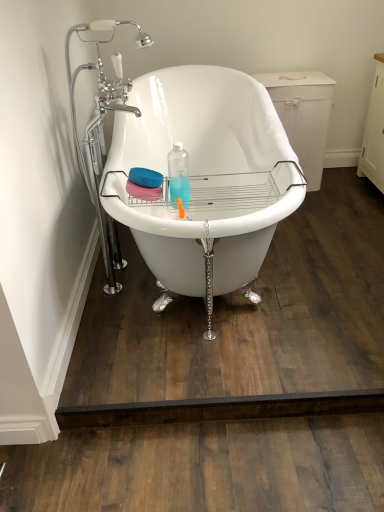
I want to click on white glossy bathtub at center, so click(x=204, y=177).

This screenshot has height=512, width=384. What do you see at coordinates (204, 177) in the screenshot? I see `white glossy bathtub at center` at bounding box center [204, 177].

Where is `chrome/metallic faucet at upper left`? The width and height of the screenshot is (384, 512). chrome/metallic faucet at upper left is located at coordinates (102, 131).

The height and width of the screenshot is (512, 384). Describe the element at coordinates (102, 131) in the screenshot. I see `chrome/metallic faucet at upper left` at that location.

Find the location of a particular element. This screenshot has height=512, width=384. white glossy bathtub at center is located at coordinates click(x=204, y=177).

In the scene shown: Can you confirm if white glossy bathtub at center is positioned to the right of chrome/metallic faucet at upper left?

Indeed, white glossy bathtub at center is positioned on the right side of chrome/metallic faucet at upper left.

Which object is further away from the camera, white glossy bathtub at center or chrome/metallic faucet at upper left?

chrome/metallic faucet at upper left is behind.

Which is in front, point (146, 129) or point (104, 103)?

The point (104, 103) is in front.

From the image's perspective, is white glossy bathtub at center under chrome/metallic faucet at upper left?

Yes, from the image's perspective, white glossy bathtub at center is beneath chrome/metallic faucet at upper left.

From a real-world perspective, is white glossy bathtub at center on chrome/metallic faucet at upper left?

Actually, white glossy bathtub at center is physically below chrome/metallic faucet at upper left in the real world.

From the picture: Which of these two, white glossy bathtub at center or chrome/metallic faucet at upper left, is wider?

With larger width is white glossy bathtub at center.

Considering the sizes of objects white glossy bathtub at center and chrome/metallic faucet at upper left in the image provided, who is shorter, white glossy bathtub at center or chrome/metallic faucet at upper left?

Standing shorter between the two is white glossy bathtub at center.

Is white glossy bathtub at center bigger or smaller than chrome/metallic faucet at upper left?

In the image, white glossy bathtub at center appears to be larger than chrome/metallic faucet at upper left.

Looking at this image, would you say white glossy bathtub at center is inside or outside chrome/metallic faucet at upper left?

white glossy bathtub at center is located beyond the bounds of chrome/metallic faucet at upper left.

Is white glossy bathtub at center not near chrome/metallic faucet at upper left?

That's not correct — white glossy bathtub at center is a little close to chrome/metallic faucet at upper left.

Is white glossy bathtub at center looking in the opposite direction of chrome/metallic faucet at upper left?

Yes, white glossy bathtub at center is facing away from chrome/metallic faucet at upper left.

How far apart are white glossy bathtub at center and chrome/metallic faucet at upper left?

white glossy bathtub at center and chrome/metallic faucet at upper left are 19.14 inches apart from each other.

Locate an element on the screen. This screenshot has width=384, height=512. faucet on the left of white glossy bathtub at center is located at coordinates (102, 131).

Considering the relative positions of chrome/metallic faucet at upper left and white glossy bathtub at center in the image provided, is chrome/metallic faucet at upper left to the left or to the right of white glossy bathtub at center?

chrome/metallic faucet at upper left is to the left of white glossy bathtub at center.

Is chrome/metallic faucet at upper left further to the viewer compared to white glossy bathtub at center?

Yes, it is.

Between point (97, 89) and point (183, 101), which one is positioned in front?

The point (97, 89) is in front.

From the image's perspective, is chrome/metallic faucet at upper left above or below white glossy bathtub at center?

chrome/metallic faucet at upper left is situated higher than white glossy bathtub at center in the image.

From a real-world perspective, is chrome/metallic faucet at upper left physically located above or below white glossy bathtub at center?

chrome/metallic faucet at upper left is above white glossy bathtub at center.

Is chrome/metallic faucet at upper left thinner than white glossy bathtub at center?

Correct, the width of chrome/metallic faucet at upper left is less than that of white glossy bathtub at center.

Based on the photo, considering the relative sizes of chrome/metallic faucet at upper left and white glossy bathtub at center in the image provided, is chrome/metallic faucet at upper left shorter than white glossy bathtub at center?

No, chrome/metallic faucet at upper left is not shorter than white glossy bathtub at center.

Based on their sizes in the image, would you say chrome/metallic faucet at upper left is bigger or smaller than white glossy bathtub at center?

In the image, chrome/metallic faucet at upper left appears to be smaller than white glossy bathtub at center.

Is chrome/metallic faucet at upper left not inside white glossy bathtub at center?

Actually, chrome/metallic faucet at upper left is at least partially inside white glossy bathtub at center.

Is chrome/metallic faucet at upper left far from white glossy bathtub at center?

No, chrome/metallic faucet at upper left is not far from white glossy bathtub at center.

Is chrome/metallic faucet at upper left turned away from white glossy bathtub at center?

Absolutely, chrome/metallic faucet at upper left is directed away from white glossy bathtub at center.

Identify the location of bathtub on the right of chrome/metallic faucet at upper left. The width and height of the screenshot is (384, 512). (204, 177).

Where is `bathtub that appears on the right of chrome/metallic faucet at upper left`? The image size is (384, 512). bathtub that appears on the right of chrome/metallic faucet at upper left is located at coordinates (204, 177).

This screenshot has height=512, width=384. In order to click on faucet above the white glossy bathtub at center (from a real-world perspective) in this screenshot , I will do `click(102, 131)`.